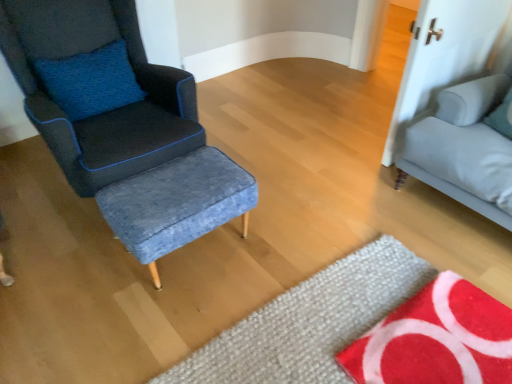
Identify the location of free space behind textured wool mat at lower center, positioned as the 1th mat in left-to-right order. The width and height of the screenshot is (512, 384). (331, 213).